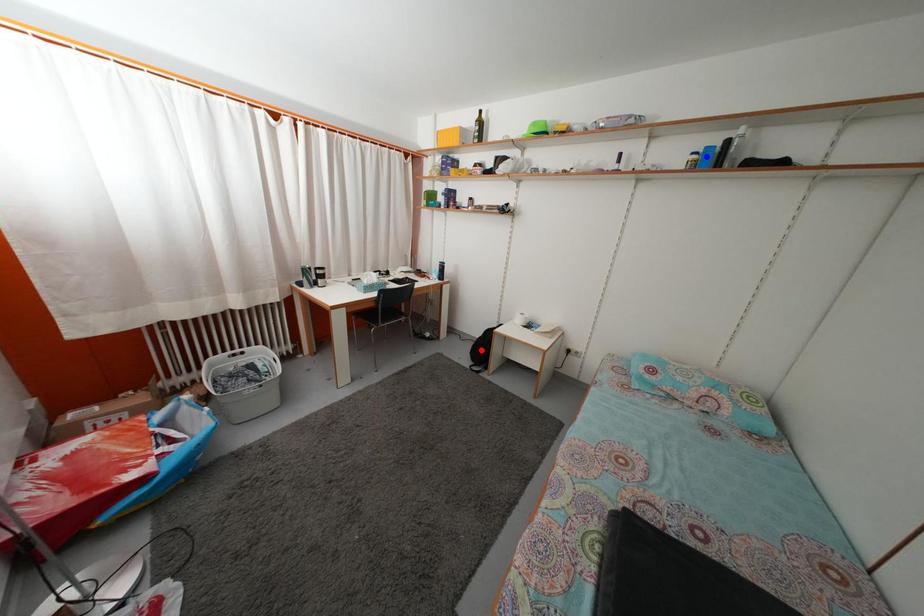
Question: Two points are marked on the image. Which point is closer to the camera?

Choices:
 (A) Blue point is closer.
 (B) Red point is closer.

Answer: (A)